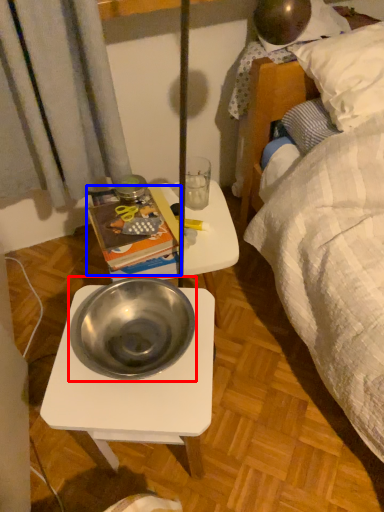
Question: Which of the following is the farthest to the observer, bowl (highlighted by a red box) or paperback book (highlighted by a blue box)?

Choices:
 (A) bowl
 (B) paperback book

Answer: (B)